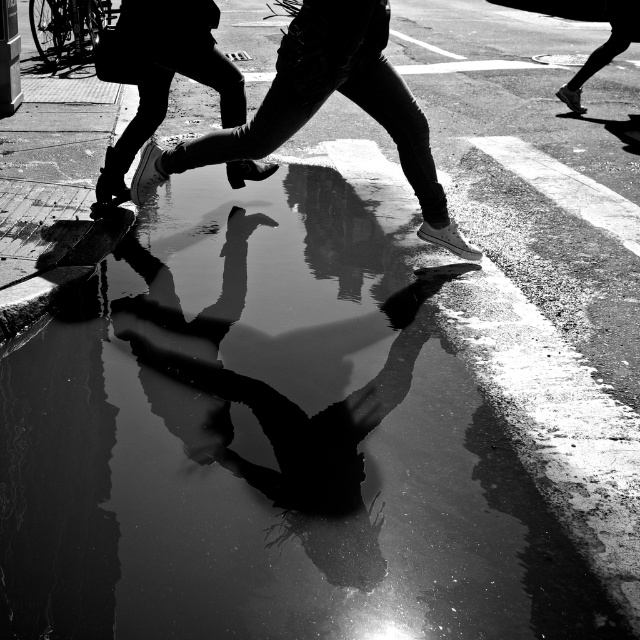
Question: Is the position of smooth leather shoe at center more distant than that of white leather shoe at upper left?

Choices:
 (A) no
 (B) yes

Answer: (A)

Question: Which point is farther to the camera?

Choices:
 (A) smooth leather shoe at center
 (B) white leather shoe at upper left

Answer: (B)

Question: Is smooth leather shoe at center to the left of white leather shoe at upper left from the viewer's perspective?

Choices:
 (A) yes
 (B) no

Answer: (B)

Question: Considering the relative positions of smooth leather shoe at center and white leather shoe at upper left in the image provided, where is smooth leather shoe at center located with respect to white leather shoe at upper left?

Choices:
 (A) left
 (B) right

Answer: (B)

Question: Which of the following is the farthest from the observer?

Choices:
 (A) white leather shoe at upper left
 (B) smooth leather shoe at center

Answer: (A)